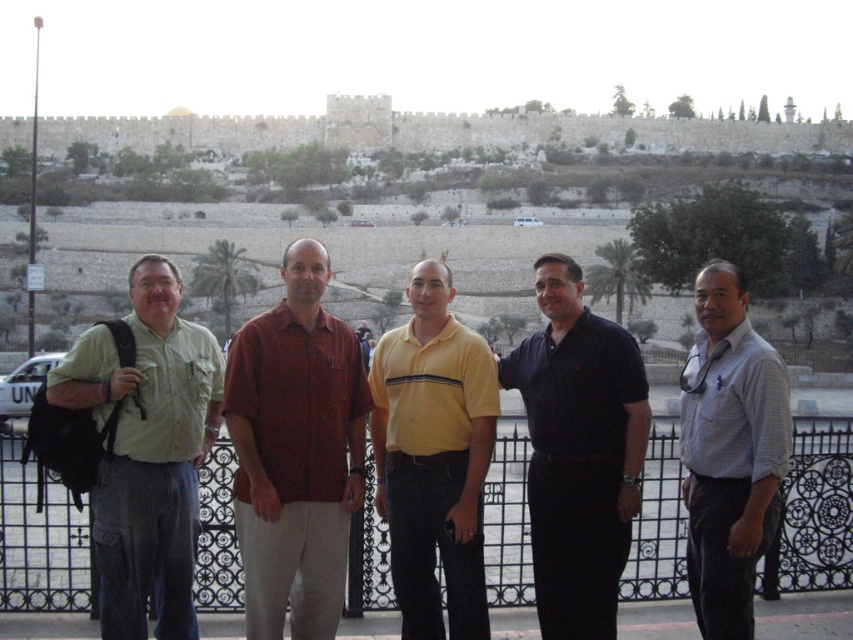
Between black metal fence at center and yellow cotton polo shirt at center, which one has less height?

black metal fence at center is shorter.

Does point (209, 492) come closer to viewer compared to point (410, 276)?

Yes, point (209, 492) is closer to viewer.

Find the location of `black metal fence at center`. black metal fence at center is located at coordinates (38, 540).

Is maroon fabric shirt at center positioned behind yellow cotton polo shirt at center?

No, it is in front of yellow cotton polo shirt at center.

Does maroon fabric shirt at center have a lesser height compared to yellow cotton polo shirt at center?

In fact, maroon fabric shirt at center may be taller than yellow cotton polo shirt at center.

I want to click on maroon fabric shirt at center, so click(x=294, y=451).

What do you see at coordinates (433, 458) in the screenshot?
I see `yellow cotton polo shirt at center` at bounding box center [433, 458].

Does yellow cotton polo shirt at center appear on the right side of white checkered shirt at right?

In fact, yellow cotton polo shirt at center is to the left of white checkered shirt at right.

This screenshot has width=853, height=640. Identify the location of yellow cotton polo shirt at center. (433, 458).